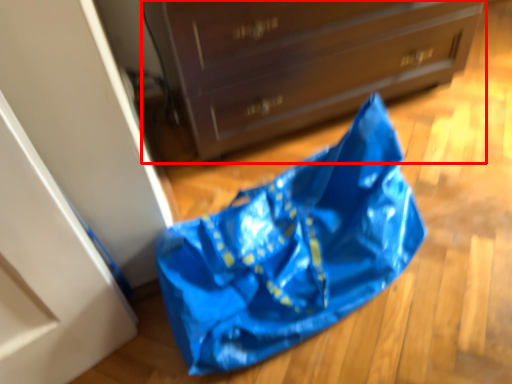
Question: From the image's perspective, where is chest of drawers (annotated by the red box) located in relation to grocery bag in the image?

Choices:
 (A) below
 (B) above

Answer: (B)